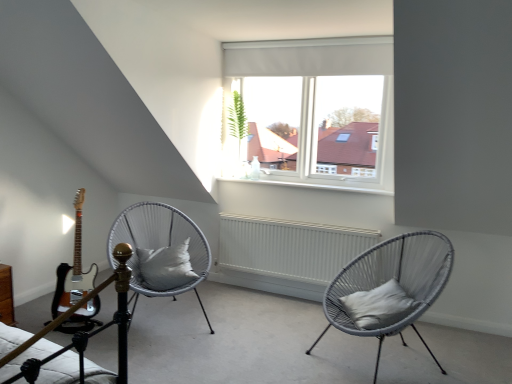
Question: From the image's perspective, is white glossy electric guitar at left located above or below woven grey chair at center, the 1th chair viewed from the right?

Choices:
 (A) above
 (B) below

Answer: (A)

Question: Considering the positions of white glossy electric guitar at left and woven grey chair at center, the 1th chair viewed from the right, in the image, is white glossy electric guitar at left bigger or smaller than woven grey chair at center, the 1th chair viewed from the right,?

Choices:
 (A) small
 (B) big

Answer: (A)

Question: Which of these objects is positioned closest to the woven grey chair at center, the second chair viewed from the left?

Choices:
 (A) white glossy electric guitar at left
 (B) white matte radiator at center
 (C) gray fabric pillow at right, which is counted as the first pillow, starting from the front
 (D) white woven chair at center, placed as the 1th chair when sorted from left to right
 (E) white fabric pillow at center, which ranks as the first pillow in left-to-right order

Answer: (C)

Question: Which object is positioned closest to the woven grey chair at center, the second chair viewed from the left?

Choices:
 (A) white glossy electric guitar at left
 (B) white matte radiator at center
 (C) gray fabric pillow at right, arranged as the 1th pillow when viewed from the right
 (D) white woven chair at center, which is the 2th chair from right to left
 (E) white fabric pillow at center, placed as the second pillow when sorted from front to back

Answer: (C)